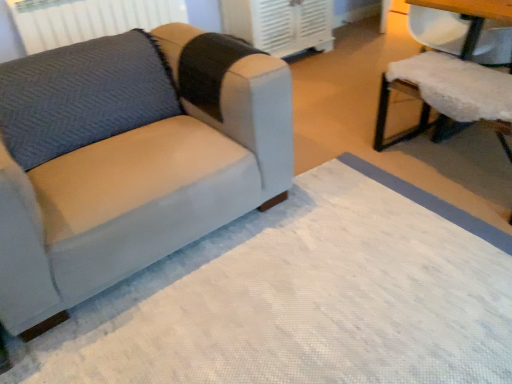
Question: Is white textured mat at lower left taller or shorter than gray fabric radiator at upper left?

Choices:
 (A) tall
 (B) short

Answer: (B)

Question: From a real-world perspective, is white textured mat at lower left physically located above or below gray fabric radiator at upper left?

Choices:
 (A) below
 (B) above

Answer: (A)

Question: Which is farther from the white plastic air conditioner at upper center?

Choices:
 (A) gray fabric radiator at upper left
 (B) white fluffy cushion at right
 (C) white textured mat at lower left
 (D) suede-like gray couch at left

Answer: (C)

Question: Considering the real-world distances, which object is farthest from the white textured mat at lower left?

Choices:
 (A) white fluffy cushion at right
 (B) white plastic air conditioner at upper center
 (C) gray fabric radiator at upper left
 (D) suede-like gray couch at left

Answer: (B)